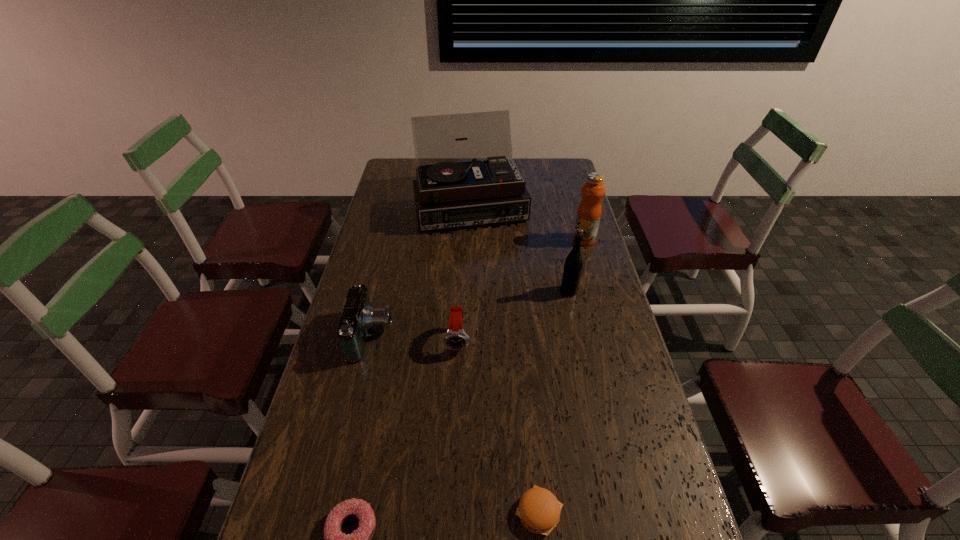
At what (x,y) coordinates should I click in order to perform the action: click on free space at the right edge of the desktop. Please return your answer as a coordinate pair (x, y). The height and width of the screenshot is (540, 960). Looking at the image, I should click on (597, 345).

The height and width of the screenshot is (540, 960). Find the location of `unoccupied position between the second object from right to left and the camcorder`. unoccupied position between the second object from right to left and the camcorder is located at coordinates (470, 313).

Locate an element on the screen. The width and height of the screenshot is (960, 540). free space between the rightmost object and the patty is located at coordinates (562, 376).

The width and height of the screenshot is (960, 540). In order to click on free point between the watch and the beer bottle in this screenshot , I will do `click(514, 316)`.

Find the location of `free space between the tallest object and the patty`. free space between the tallest object and the patty is located at coordinates (505, 359).

Locate an element on the screen. The height and width of the screenshot is (540, 960). unoccupied area between the beer bottle and the camcorder is located at coordinates (470, 313).

Select which object appears as the closest to the doughnut. Please provide its 2D coordinates. Your answer should be formatted as a tuple, i.e. [(x, y)], where the tuple contains the x and y coordinates of a point satisfying the conditions above.

[(539, 510)]

Choose which object is the second nearest neighbor to the camcorder. Please provide its 2D coordinates. Your answer should be formatted as a tuple, i.e. [(x, y)], where the tuple contains the x and y coordinates of a point satisfying the conditions above.

[(360, 539)]

Where is `blank area in the image that satisfies the following two spatial constraints: 1. on the front-facing side of the camcorder; 2. on the left side of the patty`? blank area in the image that satisfies the following two spatial constraints: 1. on the front-facing side of the camcorder; 2. on the left side of the patty is located at coordinates (330, 512).

At what (x,y) coordinates should I click in order to perform the action: click on vacant area in the image that satisfies the following two spatial constraints: 1. on the face of the patty; 2. on the right side of the watch. Please return your answer as a coordinate pair (x, y). Looking at the image, I should click on (450, 512).